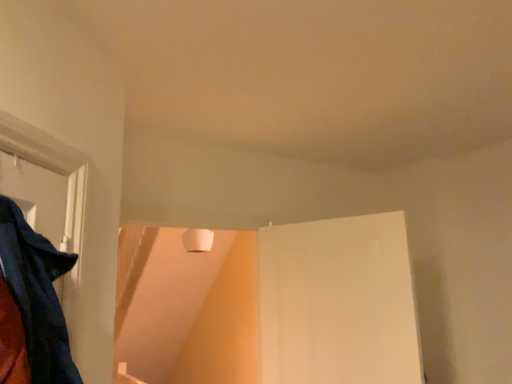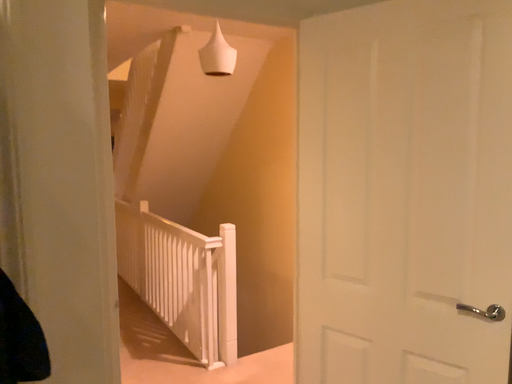
Question: Which way did the camera rotate in the video?

Choices:
 (A) rotated upward
 (B) rotated downward

Answer: (B)